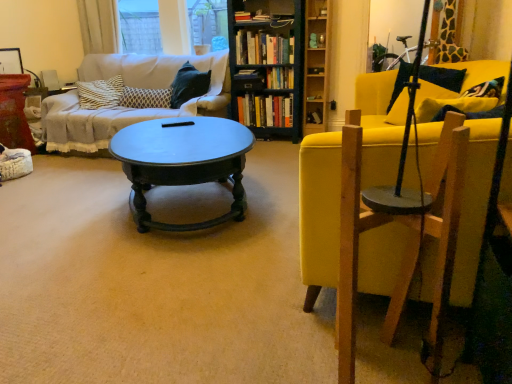
You are a GUI agent. You are given a task and a screenshot of the screen. Output one action in this format:
    pyautogui.click(x=<x>, y=<y>)
    Task: Click on the free space on the front side of wooden bookshelf at center
    The width and height of the screenshot is (512, 384).
    Given the screenshot: What is the action you would take?
    pyautogui.click(x=268, y=145)